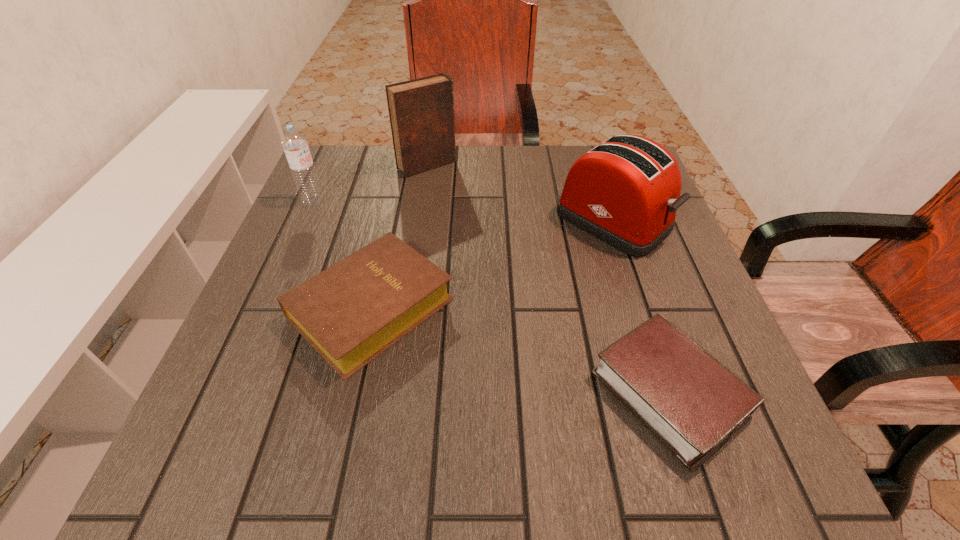
Locate an element on the screen. free space in the image that satisfies the following two spatial constraints: 1. on the front side of the water bottle; 2. on the left side of the rightmost Bible is located at coordinates (229, 393).